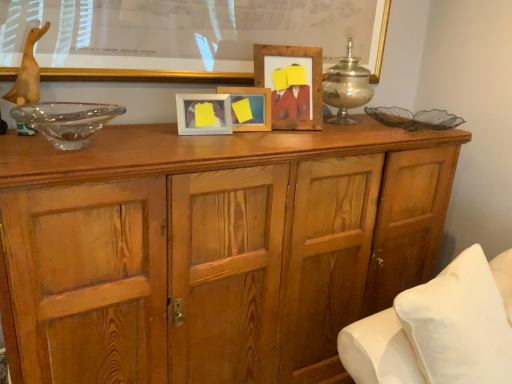
Question: From the image's perspective, does wooden picture frame at center, which ranks as the 3th picture frame in left-to-right order, appear lower than wooden cabinet at center?

Choices:
 (A) no
 (B) yes

Answer: (A)

Question: Is wooden picture frame at center, which ranks as the 3th picture frame in left-to-right order, further to the viewer compared to wooden cabinet at center?

Choices:
 (A) yes
 (B) no

Answer: (A)

Question: From a real-world perspective, is wooden picture frame at center, which ranks as the 1th picture frame in right-to-left order, beneath wooden cabinet at center?

Choices:
 (A) no
 (B) yes

Answer: (A)

Question: Is wooden picture frame at center, which ranks as the 1th picture frame in right-to-left order, outside of wooden cabinet at center?

Choices:
 (A) no
 (B) yes

Answer: (B)

Question: Is wooden picture frame at center, which ranks as the 1th picture frame in right-to-left order, facing away from wooden cabinet at center?

Choices:
 (A) yes
 (B) no

Answer: (B)

Question: Are wooden picture frame at center, which ranks as the 3th picture frame in left-to-right order, and wooden cabinet at center located far from each other?

Choices:
 (A) yes
 (B) no

Answer: (B)

Question: Does white soft pillow at lower right appear on the right side of silver metallic candle holder at upper center?

Choices:
 (A) no
 (B) yes

Answer: (B)

Question: Considering the relative sizes of white soft pillow at lower right and silver metallic candle holder at upper center in the image provided, is white soft pillow at lower right thinner than silver metallic candle holder at upper center?

Choices:
 (A) yes
 (B) no

Answer: (B)

Question: Does white soft pillow at lower right turn towards silver metallic candle holder at upper center?

Choices:
 (A) yes
 (B) no

Answer: (B)

Question: Is white soft pillow at lower right beside silver metallic candle holder at upper center?

Choices:
 (A) yes
 (B) no

Answer: (B)

Question: From the image's perspective, would you say white soft pillow at lower right is shown under silver metallic candle holder at upper center?

Choices:
 (A) yes
 (B) no

Answer: (A)

Question: Is silver metallic candle holder at upper center inside white soft pillow at lower right?

Choices:
 (A) no
 (B) yes

Answer: (A)

Question: From a real-world perspective, is silver metallic candle holder at upper center located higher than transparent glass bowl at left?

Choices:
 (A) yes
 (B) no

Answer: (A)